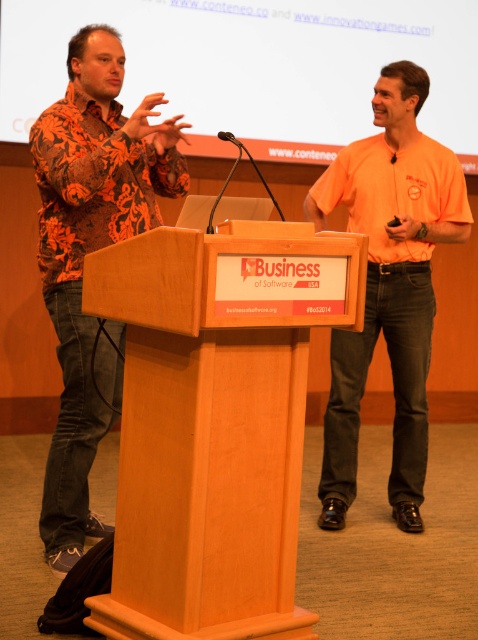
You are an event planner setting up a conference room. You need to position a 2.5 meter long projector screen between the wooden podium at center and the matte white screen at upper center. Is there enough space to place it without overlapping either object?

The wooden podium at center and matte white screen at upper center are 2.68 meters apart. Since the projector screen is 2.5 meters long, there is enough space to place it between them without overlapping either object.

You are an event organizer who needs to set up a new banner behind the wooden podium at center and orange cotton shirt at center. The banner is 1.2 meters wide. Will the banner fit between the two objects?

The wooden podium at center might be wider than orange cotton shirt at center, but since the banner is 1.2 meters wide, it is unclear if the space between them can accommodate it without knowing their exact widths and the distance between them.